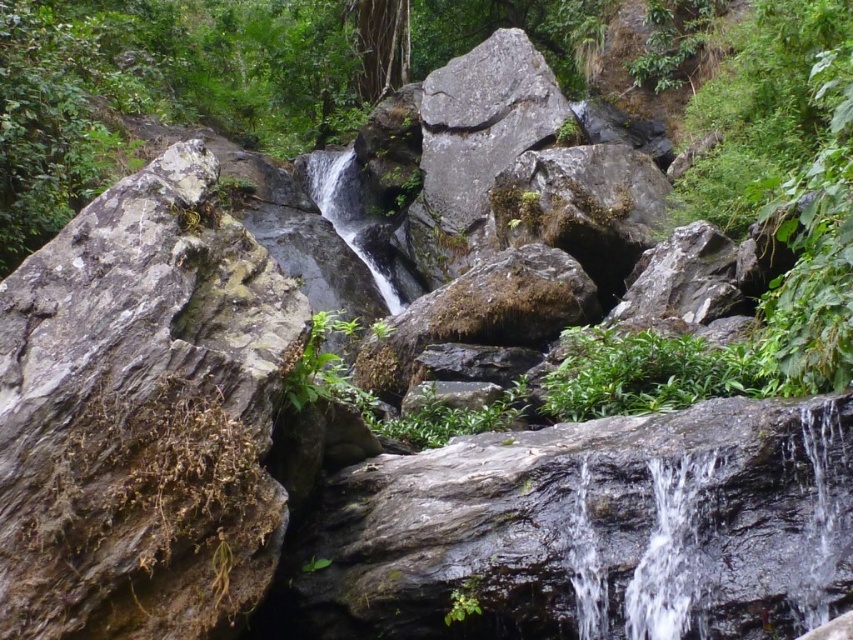
Which is more to the right, rough gray rock at left or green leafy plant at center?

green leafy plant at center is more to the right.

Who is positioned more to the left, rough gray rock at left or green leafy plant at center?

rough gray rock at left is more to the left.

Is point (94, 321) more distant than point (718, 372)?

No, it is in front of (718, 372).

Where is `rough gray rock at left`? This screenshot has width=853, height=640. rough gray rock at left is located at coordinates (142, 413).